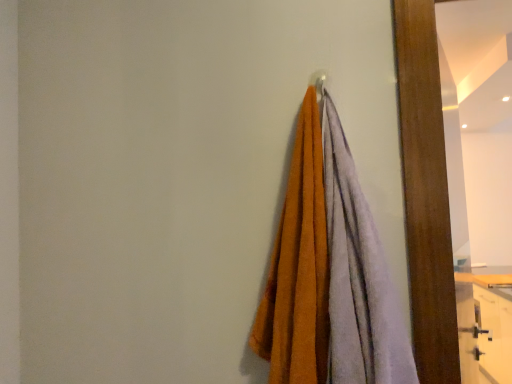
Question: Does wooden dresser at lower right turn towards soft cotton towels at center?

Choices:
 (A) yes
 (B) no

Answer: (B)

Question: Is wooden dresser at lower right thinner than soft cotton towels at center?

Choices:
 (A) no
 (B) yes

Answer: (A)

Question: Is wooden dresser at lower right turned away from soft cotton towels at center?

Choices:
 (A) no
 (B) yes

Answer: (A)

Question: Would you say wooden dresser at lower right contains soft cotton towels at center?

Choices:
 (A) yes
 (B) no

Answer: (B)

Question: Does wooden dresser at lower right have a greater height compared to soft cotton towels at center?

Choices:
 (A) no
 (B) yes

Answer: (B)

Question: From a real-world perspective, is wooden dresser at lower right on top of soft cotton towels at center?

Choices:
 (A) yes
 (B) no

Answer: (B)

Question: From the image's perspective, is wooden mirror at right above soft cotton towels at center?

Choices:
 (A) no
 (B) yes

Answer: (A)

Question: Is wooden mirror at right wider than soft cotton towels at center?

Choices:
 (A) no
 (B) yes

Answer: (A)

Question: Is wooden mirror at right to the right of soft cotton towels at center from the viewer's perspective?

Choices:
 (A) yes
 (B) no

Answer: (A)

Question: Considering the relative sizes of wooden mirror at right and soft cotton towels at center in the image provided, is wooden mirror at right taller than soft cotton towels at center?

Choices:
 (A) no
 (B) yes

Answer: (B)

Question: From the image's perspective, is wooden mirror at right under soft cotton towels at center?

Choices:
 (A) yes
 (B) no

Answer: (A)

Question: Could you tell me if wooden mirror at right is facing soft cotton towels at center?

Choices:
 (A) yes
 (B) no

Answer: (B)

Question: Is wooden dresser at lower right facing towards wooden mirror at right?

Choices:
 (A) no
 (B) yes

Answer: (A)